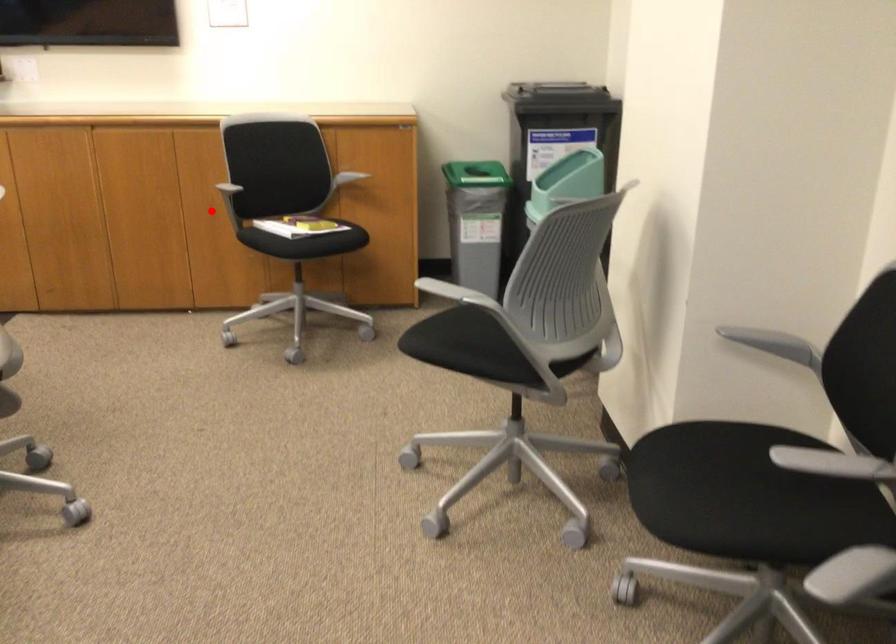
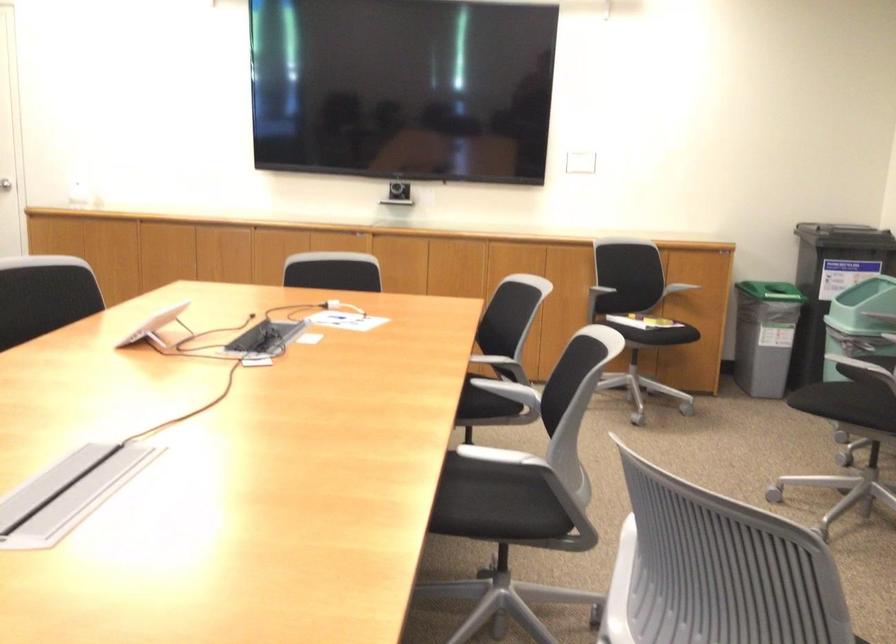
Question: I am providing you with two images of the same scene from different viewpoints. Image1 has a red point marked. In image2, the corresponding 3D location appears at what relative position? Reply with the corresponding letter.

Choices:
 (A) Closer
 (B) Farther

Answer: (B)